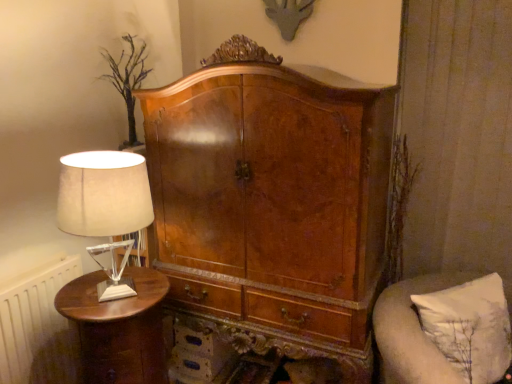
This screenshot has height=384, width=512. I want to click on vacant space underneath white fabric lampshade at left (from a real-world perspective), so click(x=102, y=291).